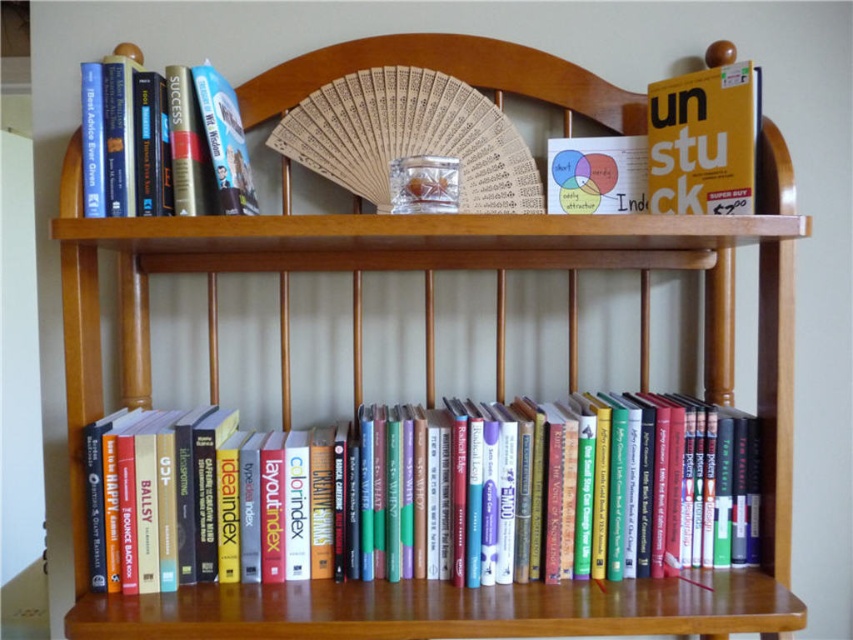
Question: Which point is closer to the camera?

Choices:
 (A) hardcover books at lower center
 (B) matte yellow book at upper right

Answer: (A)

Question: Is hardcover book at upper left wider than matte yellow book at upper right?

Choices:
 (A) no
 (B) yes

Answer: (B)

Question: Which object is positioned closest to the matte yellow book at upper right?

Choices:
 (A) hardcover books at lower center
 (B) hardcover book at upper left

Answer: (A)

Question: Estimate the real-world distances between objects in this image. Which object is farther from the matte yellow book at upper right?

Choices:
 (A) hardcover books at lower center
 (B) hardcover book at upper left

Answer: (B)

Question: Is hardcover book at upper left below matte yellow book at upper right?

Choices:
 (A) yes
 (B) no

Answer: (B)

Question: Does hardcover books at lower center have a smaller size compared to hardcover book at upper left?

Choices:
 (A) yes
 (B) no

Answer: (B)